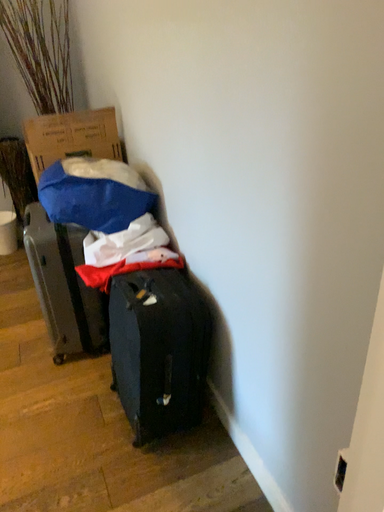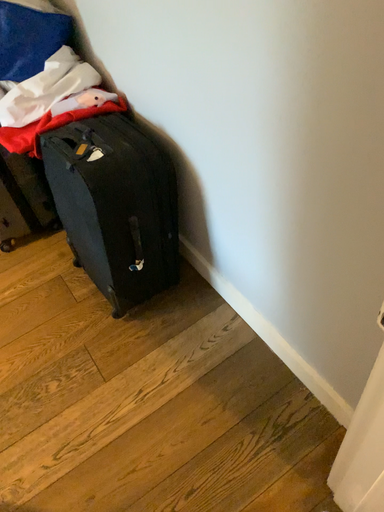
Question: How did the camera likely rotate when shooting the video?

Choices:
 (A) rotated upward
 (B) rotated downward

Answer: (B)